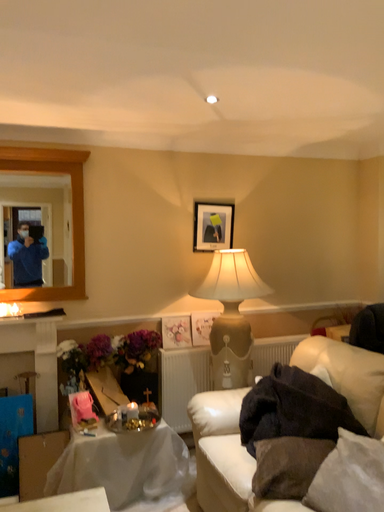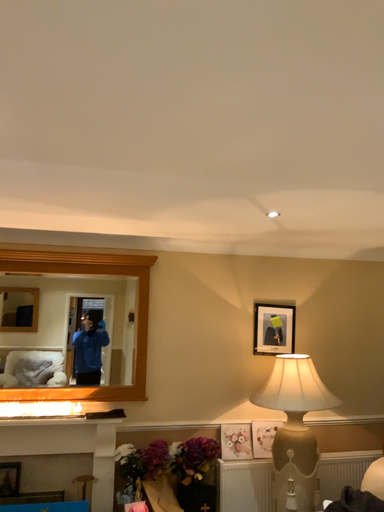
Question: Which way did the camera rotate in the video?

Choices:
 (A) rotated upward
 (B) rotated downward

Answer: (A)